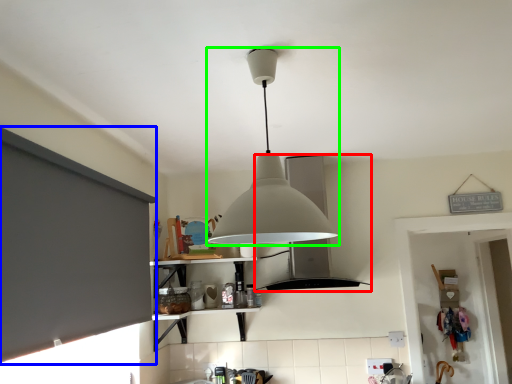
Question: Which object is the farthest from vent (highlighted by a red box)? Choose among these: window screen (highlighted by a blue box) or lamp (highlighted by a green box).

Choices:
 (A) window screen
 (B) lamp

Answer: (B)